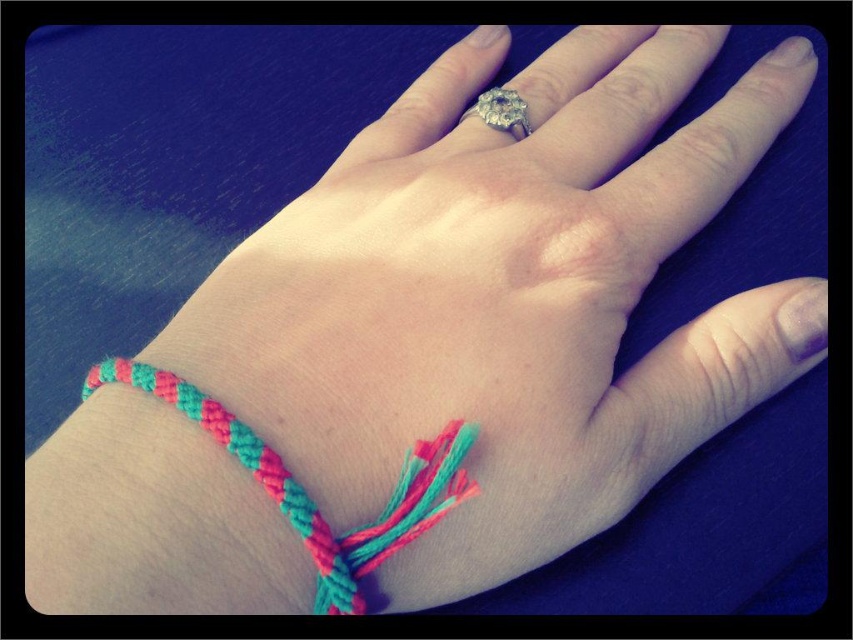
From the picture: How far apart are braided fabric bracelet at lower left and diamond ring at center?

braided fabric bracelet at lower left and diamond ring at center are 10.77 inches apart from each other.

Does point (437, 496) come behind point (524, 109)?

No, it is in front of (524, 109).

Identify the location of braided fabric bracelet at lower left. coord(306,492).